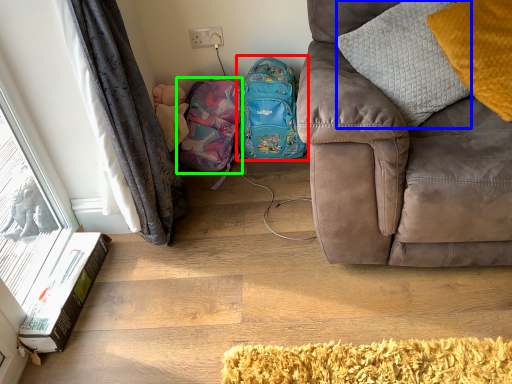
Question: Considering the real-world distances, which object is farthest from backpack (highlighted by a red box)? pillow (highlighted by a blue box) or bag (highlighted by a green box)?

Choices:
 (A) pillow
 (B) bag

Answer: (A)